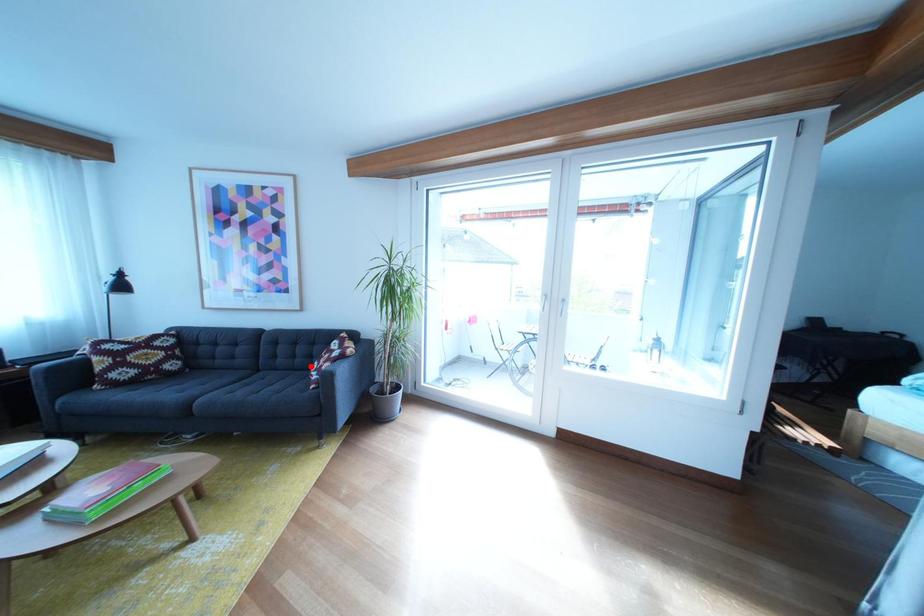
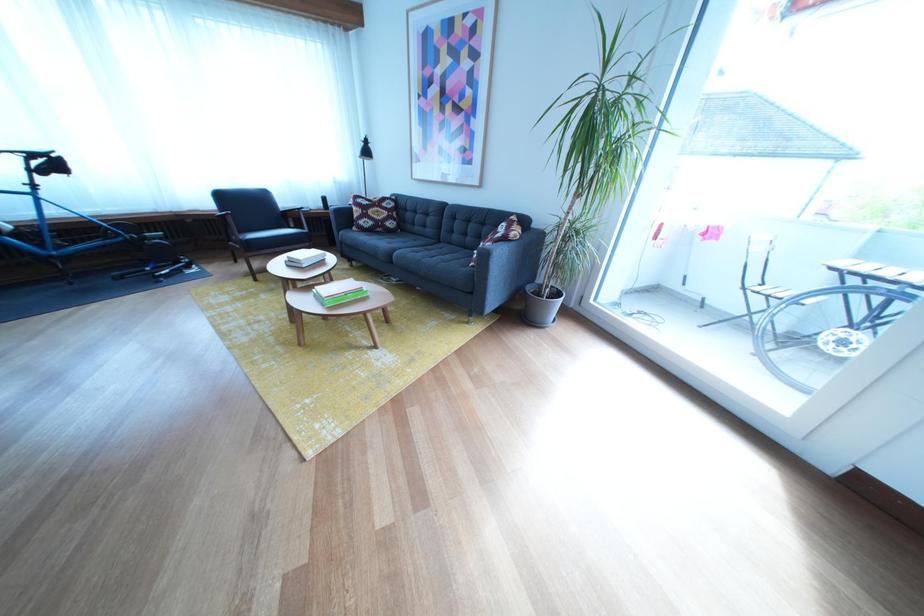
Locate, in the second image, the point that corresponds to the highlighted location in the first image.

(481, 245)